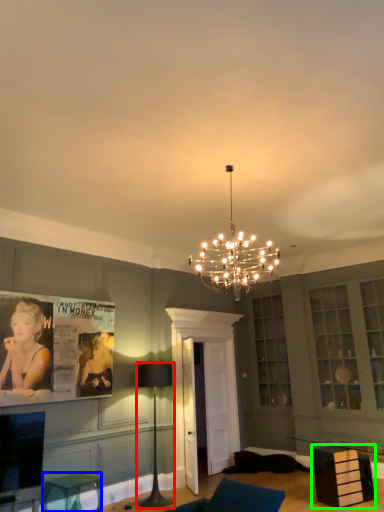
Question: Considering the real-world distances, which object is farthest from lamp (highlighted by a red box)? furniture (highlighted by a blue box) or furniture (highlighted by a green box)?

Choices:
 (A) furniture
 (B) furniture

Answer: (B)